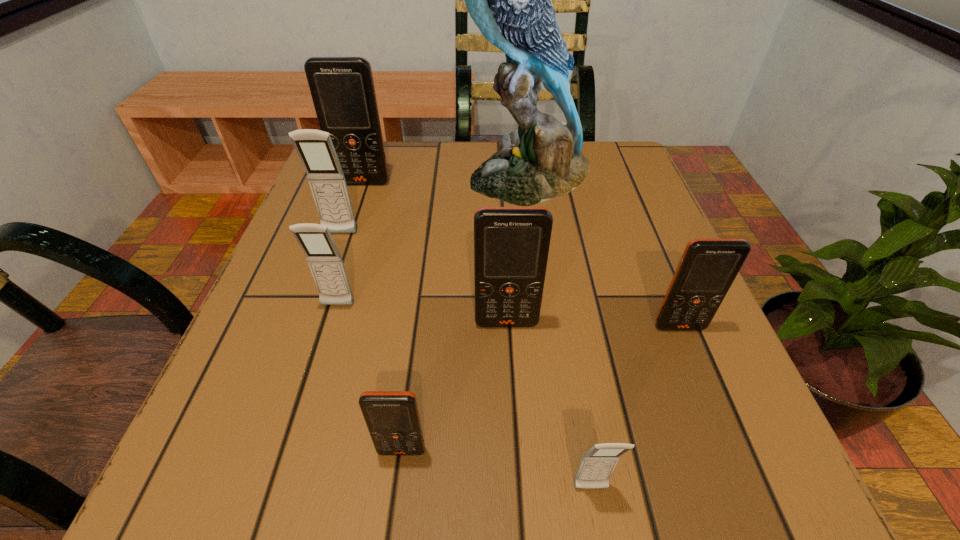
The height and width of the screenshot is (540, 960). Find the location of `parakeet`. parakeet is located at coordinates (509, 0).

Locate an element on the screen. the farthest orange cellular telephone is located at coordinates (342, 88).

The image size is (960, 540). What are the coordinates of `the seventh shortest object` in the screenshot? It's located at (342, 88).

Where is `the farthest gray cellular telephone`? Image resolution: width=960 pixels, height=540 pixels. the farthest gray cellular telephone is located at coordinates (315, 149).

Image resolution: width=960 pixels, height=540 pixels. Find the location of `the third farthest object`. the third farthest object is located at coordinates (315, 149).

Where is `the third cellular telephone from right to left`? The image size is (960, 540). the third cellular telephone from right to left is located at coordinates (511, 244).

Where is `the third smallest orange cellular telephone`? the third smallest orange cellular telephone is located at coordinates (511, 244).

I want to click on the third farthest cellular telephone, so click(325, 262).

You are a GUI agent. You are given a task and a screenshot of the screen. Output one action in this format:
    pyautogui.click(x=<x>, y=<y>)
    Task: Click on the second smallest gray cellular telephone
    
    Given the screenshot: What is the action you would take?
    pyautogui.click(x=325, y=262)

Locate an element on the screen. the rightmost object is located at coordinates (708, 267).